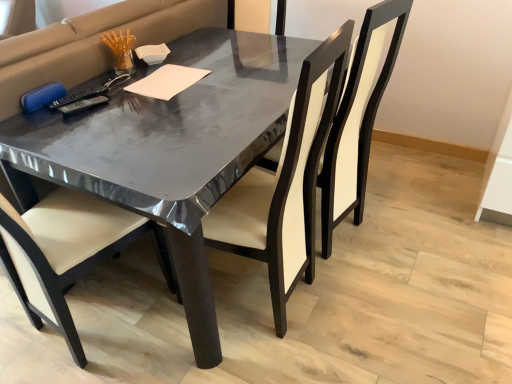
Question: Is there a large distance between white paper at center and matte black chair at center, the second chair positioned from the right?

Choices:
 (A) yes
 (B) no

Answer: (B)

Question: Considering the relative positions of white paper at center and matte black chair at center, acting as the 1th chair starting from the left, in the image provided, is white paper at center to the right of matte black chair at center, acting as the 1th chair starting from the left, from the viewer's perspective?

Choices:
 (A) yes
 (B) no

Answer: (B)

Question: From the image's perspective, would you say white paper at center is positioned over matte black chair at center, the second chair positioned from the right?

Choices:
 (A) no
 (B) yes

Answer: (B)

Question: Is white paper at center facing towards matte black chair at center, acting as the 1th chair starting from the left?

Choices:
 (A) no
 (B) yes

Answer: (A)

Question: Can we say white paper at center lies outside matte black chair at center, the second chair positioned from the right?

Choices:
 (A) no
 (B) yes

Answer: (B)

Question: Is white paper at center facing away from matte black chair at center, acting as the 1th chair starting from the left?

Choices:
 (A) no
 (B) yes

Answer: (A)

Question: From a real-world perspective, is matte black chair at center, the second chair positioned from the right, physically above matte black chair at center, the first chair positioned from the right?

Choices:
 (A) yes
 (B) no

Answer: (B)

Question: Is matte black chair at center, the second chair positioned from the right, smaller than matte black chair at center, which ranks as the second chair in left-to-right order?

Choices:
 (A) no
 (B) yes

Answer: (B)

Question: Does matte black chair at center, the second chair positioned from the right, have a lesser width compared to matte black chair at center, the first chair positioned from the right?

Choices:
 (A) no
 (B) yes

Answer: (B)

Question: Is matte black chair at center, acting as the 1th chair starting from the left, bigger than matte black chair at center, which ranks as the second chair in left-to-right order?

Choices:
 (A) no
 (B) yes

Answer: (A)

Question: Does matte black chair at center, acting as the 1th chair starting from the left, appear on the left side of matte black chair at center, the first chair positioned from the right?

Choices:
 (A) yes
 (B) no

Answer: (A)

Question: Is matte black chair at center, the second chair positioned from the right, wider than matte black chair at center, the first chair positioned from the right?

Choices:
 (A) yes
 (B) no

Answer: (B)

Question: From a real-world perspective, is matte black chair at center, which ranks as the second chair in left-to-right order, on top of matte black chair at center, the second chair positioned from the right?

Choices:
 (A) yes
 (B) no

Answer: (A)